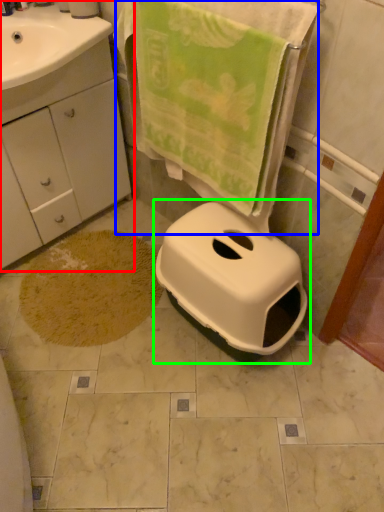
Question: Which object is positioned closest to bathroom cabinet (highlighted by a red box)? Select from beach towel (highlighted by a blue box) and toilet (highlighted by a green box).

Choices:
 (A) beach towel
 (B) toilet

Answer: (A)